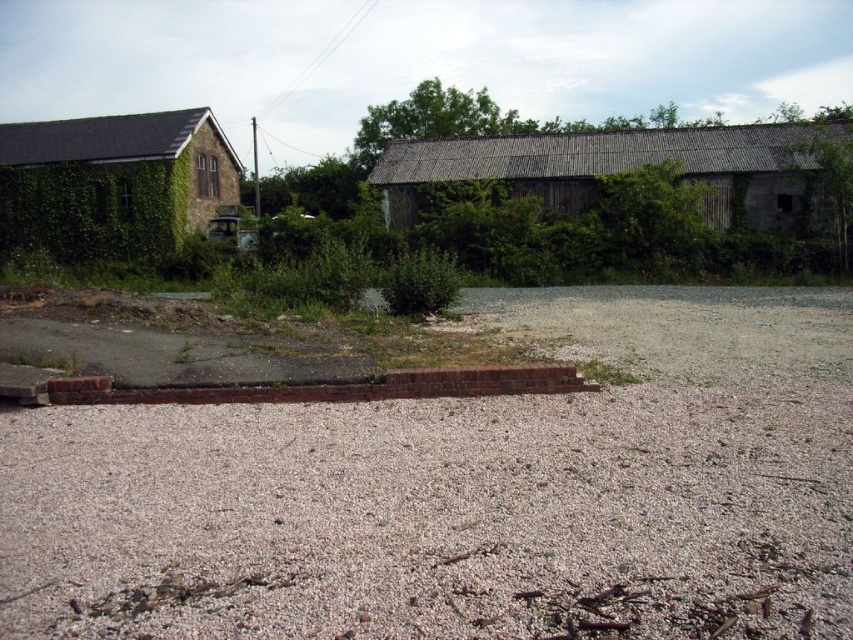
Question: Is gray gravel at center smaller than green leafy bush at center?

Choices:
 (A) yes
 (B) no

Answer: (A)

Question: Which object appears closest to the camera in this image?

Choices:
 (A) green leafy bush at center
 (B) gray gravel at center

Answer: (B)

Question: Where is gray gravel at center located in relation to green leafy bush at center in the image?

Choices:
 (A) above
 (B) below

Answer: (B)

Question: Can you confirm if gray gravel at center is bigger than green leafy bush at center?

Choices:
 (A) no
 (B) yes

Answer: (A)